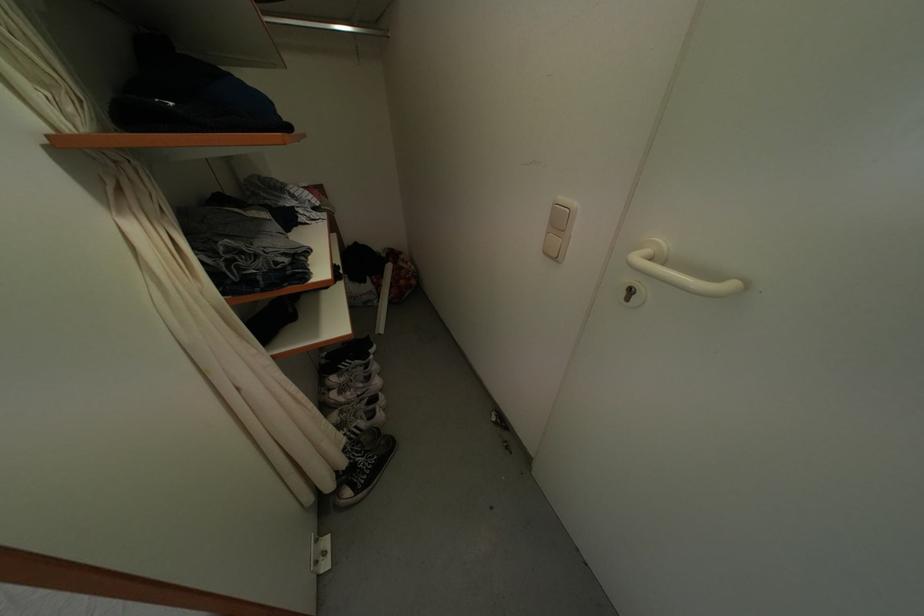
Locate an element on the screen. white door handle is located at coordinates (681, 276).